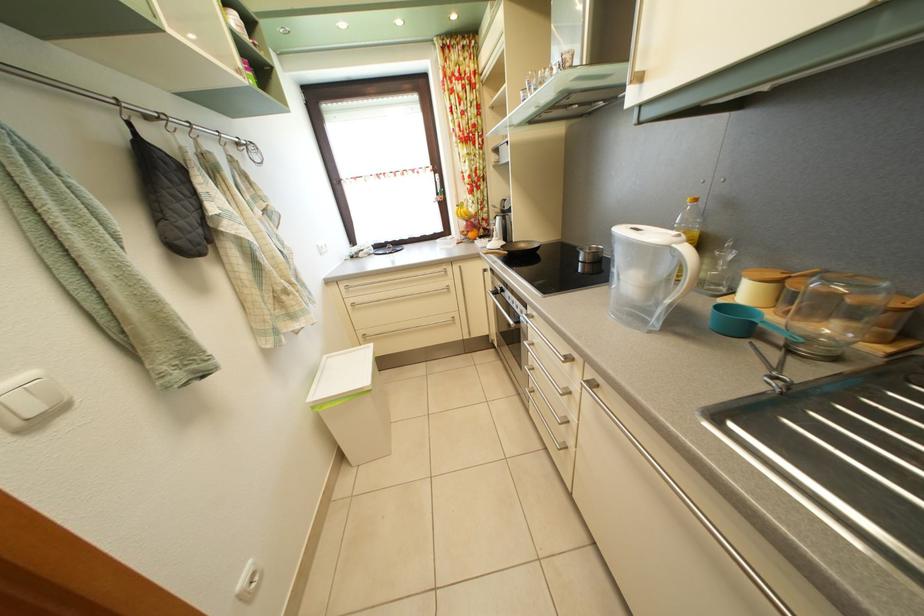
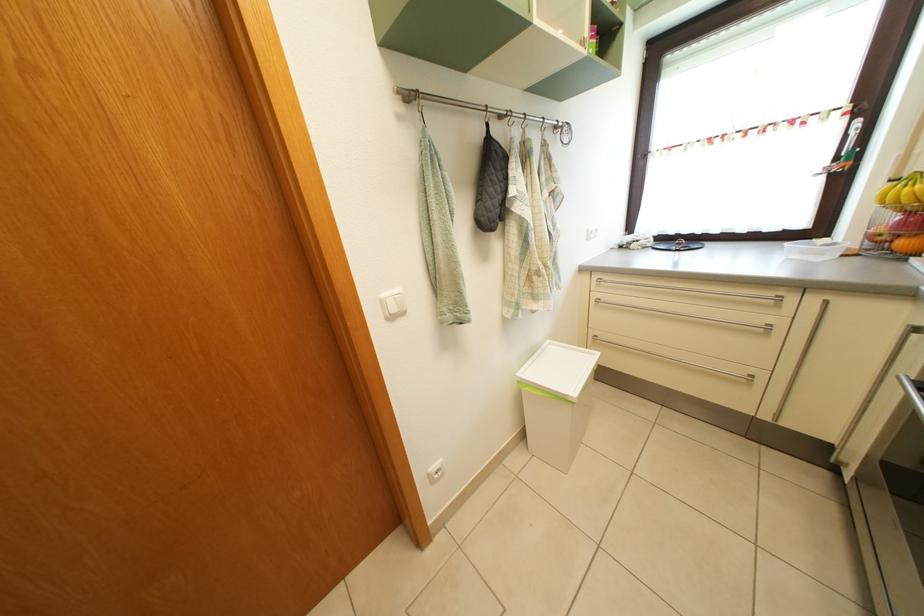
In the second image, find the point that corresponds to point (479, 243) in the first image.

(910, 252)